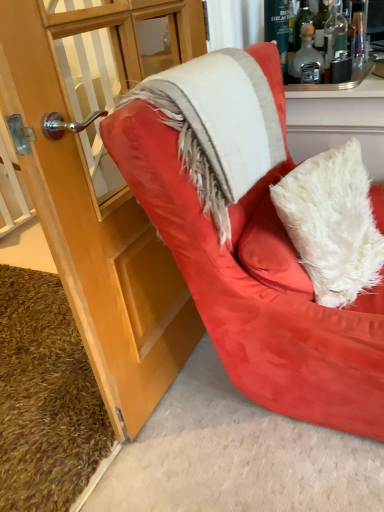
This screenshot has width=384, height=512. What are the coordinates of `translucent glass bottle at upper right, which is counted as the 2th bottle, starting from the right` in the screenshot? It's located at (305, 55).

Consider the image. What is the approximate height of matte wood cabinet at left?

matte wood cabinet at left is 1.13 meters tall.

Measure the distance between point [335,214] and camera.

1.07 meters.

What are the coordinates of `translucent glass bottle at upper right, which is the 2th bottle in left-to-right order` in the screenshot? It's located at (334, 37).

What do you see at coordinates (45, 397) in the screenshot? This screenshot has height=512, width=384. I see `brown shaggy carpet at lower left` at bounding box center [45, 397].

Locate an element on the screen. The height and width of the screenshot is (512, 384). white fuzzy blanket at upper right is located at coordinates (218, 125).

How distant is brown shaggy carpet at lower left from translucent glass bottle at upper right, marked as the 1th bottle in a left-to-right arrangement?

brown shaggy carpet at lower left and translucent glass bottle at upper right, marked as the 1th bottle in a left-to-right arrangement, are 1.40 meters apart from each other.

Does point (31, 472) come closer to viewer compared to point (289, 65)?

Yes.

Is brown shaggy carpet at lower left far from translucent glass bottle at upper right, which is counted as the 2th bottle, starting from the right?

brown shaggy carpet at lower left is far away from translucent glass bottle at upper right, which is counted as the 2th bottle, starting from the right.

Considering the positions of objects brown shaggy carpet at lower left and translucent glass bottle at upper right, which is counted as the 2th bottle, starting from the right, in the image provided, who is more to the left, brown shaggy carpet at lower left or translucent glass bottle at upper right, which is counted as the 2th bottle, starting from the right,?

brown shaggy carpet at lower left is more to the left.

From the image's perspective, between translucent glass bottle at upper right, which is the 2th bottle in left-to-right order, and white fluffy pillow at center, which one is located above?

From the image's view, translucent glass bottle at upper right, which is the 2th bottle in left-to-right order, is above.

Between translucent glass bottle at upper right, which is the 2th bottle in left-to-right order, and white fluffy pillow at center, which one has larger size?

white fluffy pillow at center is bigger.

Does point (330, 62) lie in front of point (297, 196)?

No, it is behind (297, 196).

Does translucent glass bottle at upper right, which is the 2th bottle in left-to-right order, touch white fluffy pillow at center?

translucent glass bottle at upper right, which is the 2th bottle in left-to-right order, and white fluffy pillow at center are clearly separated.

At what (x,y) coordinates should I click in order to perform the action: click on the 2nd bottle positioned above the white fluffy pillow at center (from the image's perspective). Please return your answer as a coordinate pair (x, y). Looking at the image, I should click on (334, 37).

Would you say white fluffy pillow at center contains translucent glass bottle at upper right, which is the 2th bottle in left-to-right order?

No, translucent glass bottle at upper right, which is the 2th bottle in left-to-right order, is not a part of white fluffy pillow at center.

Based on the photo, considering their positions, is white fluffy pillow at center located in front of or behind translucent glass bottle at upper right, the 1th bottle when ordered from right to left?

white fluffy pillow at center is in front of translucent glass bottle at upper right, the 1th bottle when ordered from right to left.

Is white fluffy pillow at center turned away from translucent glass bottle at upper right, the 1th bottle when ordered from right to left?

white fluffy pillow at center is not turned away from translucent glass bottle at upper right, the 1th bottle when ordered from right to left.

Would you consider white fuzzy blanket at upper right to be distant from translucent glass bottle at upper right, which is counted as the 2th bottle, starting from the right?

Actually, white fuzzy blanket at upper right and translucent glass bottle at upper right, which is counted as the 2th bottle, starting from the right, are a little close together.

From a real-world perspective, is white fuzzy blanket at upper right above or below translucent glass bottle at upper right, which is counted as the 2th bottle, starting from the right?

white fuzzy blanket at upper right is below translucent glass bottle at upper right, which is counted as the 2th bottle, starting from the right.

What's the angular difference between white fuzzy blanket at upper right and translucent glass bottle at upper right, which is counted as the 2th bottle, starting from the right,'s facing directions?

They differ by 2.11 degrees in their facing directions.

From the image's perspective, does white fuzzy blanket at upper right appear higher than translucent glass bottle at upper right, which is counted as the 2th bottle, starting from the right?

No, from the image's perspective, white fuzzy blanket at upper right is not above translucent glass bottle at upper right, which is counted as the 2th bottle, starting from the right.

Is brown shaggy carpet at lower left positioned in front of matte wood cabinet at left?

No, brown shaggy carpet at lower left is behind matte wood cabinet at left.

From a real-world perspective, is brown shaggy carpet at lower left physically below matte wood cabinet at left?

Yes, from a real-world perspective, brown shaggy carpet at lower left is under matte wood cabinet at left.

How different are the orientations of brown shaggy carpet at lower left and matte wood cabinet at left in degrees?

brown shaggy carpet at lower left and matte wood cabinet at left are facing 3.17 degrees away from each other.

Considering the points (45, 330) and (179, 19), which point is in front, point (45, 330) or point (179, 19)?

Point (179, 19)

Does brown shaggy carpet at lower left appear on the right side of white fluffy pillow at center?

In fact, brown shaggy carpet at lower left is to the left of white fluffy pillow at center.

Based on the photo, is brown shaggy carpet at lower left outside of white fluffy pillow at center?

Yes, brown shaggy carpet at lower left is not within white fluffy pillow at center.

The width and height of the screenshot is (384, 512). I want to click on doormat behind the white fluffy pillow at center, so click(45, 397).

Considering the sizes of objects brown shaggy carpet at lower left and white fluffy pillow at center in the image provided, who is wider, brown shaggy carpet at lower left or white fluffy pillow at center?

With larger width is brown shaggy carpet at lower left.

Considering the sizes of objects white fuzzy blanket at upper right and white fluffy pillow at center in the image provided, who is smaller, white fuzzy blanket at upper right or white fluffy pillow at center?

white fuzzy blanket at upper right is smaller.

Can you confirm if white fuzzy blanket at upper right is shorter than white fluffy pillow at center?

Indeed, white fuzzy blanket at upper right has a lesser height compared to white fluffy pillow at center.

From a real-world perspective, is white fuzzy blanket at upper right positioned above or below white fluffy pillow at center?

white fuzzy blanket at upper right is above white fluffy pillow at center.

Where is `pillow below the white fuzzy blanket at upper right (from the image's perspective)`? This screenshot has width=384, height=512. pillow below the white fuzzy blanket at upper right (from the image's perspective) is located at coordinates (332, 223).

Find the location of `doormat below the translucent glass bottle at upper right, marked as the 1th bottle in a left-to-right arrangement (from the image's perspective)`. doormat below the translucent glass bottle at upper right, marked as the 1th bottle in a left-to-right arrangement (from the image's perspective) is located at coordinates (45, 397).

Where is `bottle located on the right of white fluffy pillow at center`? bottle located on the right of white fluffy pillow at center is located at coordinates (334, 37).

Considering their positions, is translucent glass bottle at upper right, the 1th bottle when ordered from right to left, positioned closer to suede red armchair at center than white fluffy pillow at center?

white fluffy pillow at center.

Which object lies nearer to the anchor point white fluffy pillow at center, translucent glass bottle at upper right, marked as the 1th bottle in a left-to-right arrangement, or suede red armchair at center?

Based on the image, suede red armchair at center appears to be nearer to white fluffy pillow at center.

From the image, which object appears to be farther from white fluffy pillow at center, suede red armchair at center or brown shaggy carpet at lower left?

Based on the image, brown shaggy carpet at lower left appears to be further to white fluffy pillow at center.

Based on their spatial positions, is translucent glass bottle at upper right, the 1th bottle when ordered from right to left, or translucent glass bottle at upper right, which is counted as the 2th bottle, starting from the right, closer to brown shaggy carpet at lower left?

Based on the image, translucent glass bottle at upper right, which is counted as the 2th bottle, starting from the right, appears to be nearer to brown shaggy carpet at lower left.

Which object lies nearer to the anchor point brown shaggy carpet at lower left, suede red armchair at center or translucent glass bottle at upper right, which is the 2th bottle in left-to-right order?

suede red armchair at center is positioned closer to the anchor brown shaggy carpet at lower left.

Considering their positions, is white fuzzy blanket at upper right positioned further to brown shaggy carpet at lower left than suede red armchair at center?

The object further to brown shaggy carpet at lower left is white fuzzy blanket at upper right.

Which object lies nearer to the anchor point translucent glass bottle at upper right, which is counted as the 2th bottle, starting from the right, suede red armchair at center or white fluffy pillow at center?

Based on the image, white fluffy pillow at center appears to be nearer to translucent glass bottle at upper right, which is counted as the 2th bottle, starting from the right.

When comparing their distances from translucent glass bottle at upper right, the 1th bottle when ordered from right to left, does translucent glass bottle at upper right, which is counted as the 2th bottle, starting from the right, or suede red armchair at center seem closer?

translucent glass bottle at upper right, which is counted as the 2th bottle, starting from the right, lies closer to translucent glass bottle at upper right, the 1th bottle when ordered from right to left, than the other object.

Where is `cabinetry between brown shaggy carpet at lower left and translucent glass bottle at upper right, which is the 2th bottle in left-to-right order`? cabinetry between brown shaggy carpet at lower left and translucent glass bottle at upper right, which is the 2th bottle in left-to-right order is located at coordinates (101, 193).

The image size is (384, 512). I want to click on pillow positioned between suede red armchair at center and translucent glass bottle at upper right, which is the 2th bottle in left-to-right order, from near to far, so click(x=332, y=223).

At what (x,y) coordinates should I click in order to perform the action: click on pillow positioned between matte wood cabinet at left and translucent glass bottle at upper right, which is counted as the 2th bottle, starting from the right, from near to far. Please return your answer as a coordinate pair (x, y). Image resolution: width=384 pixels, height=512 pixels. Looking at the image, I should click on (332, 223).

This screenshot has width=384, height=512. Identify the location of cabinetry between brown shaggy carpet at lower left and translucent glass bottle at upper right, marked as the 1th bottle in a left-to-right arrangement, in the horizontal direction. (101, 193).